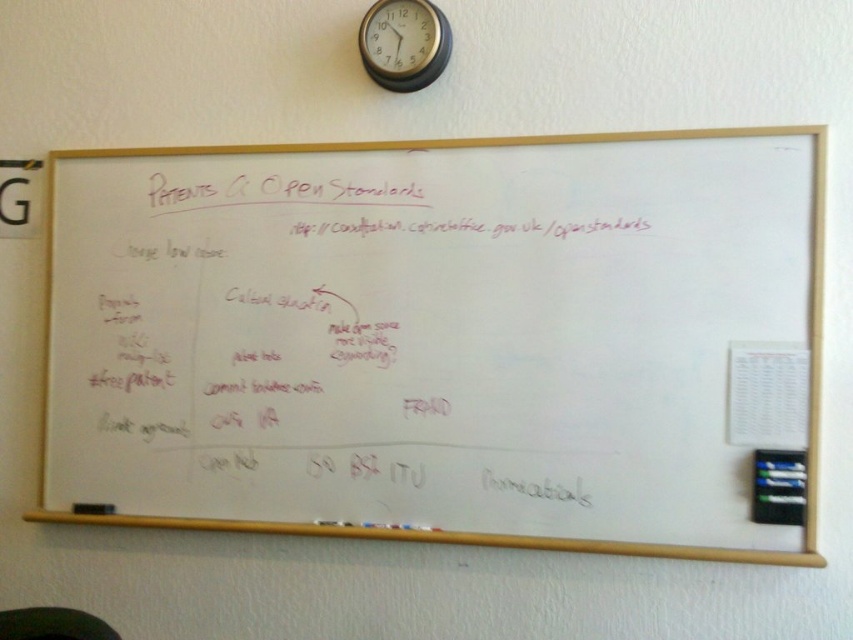
What is the relationship between the whiteboard at center and the black plastic clock at upper center in terms of their positions?

The whiteboard at center is in front of the black plastic clock at upper center, so the whiteboard is closer to the observer while the clock is positioned behind it.

You are an office worker who needs to hang a new poster that is 1.2 meters wide. The poster must be placed above the whiteboard at center without covering the black plastic clock at upper center. Can the poster fit in this space?

The whiteboard at center has a larger size compared to the black plastic clock at upper center. Since the whiteboard is larger, there might be enough space above it to hang the 1.2 meter wide poster without covering the clock. However, the exact placement would depend on the available vertical space between the whiteboard and the clock.

You are a student who needs to copy down the URL from the whiteboard at center but you can only reach up to 1.5 meters. Can you reach the URL located near the black plastic clock at upper center?

The distance between the whiteboard at center and the black plastic clock at upper center is 55.41 centimeters. Since you can reach up to 1.5 meters, you can easily reach the URL near the black plastic clock at upper center.